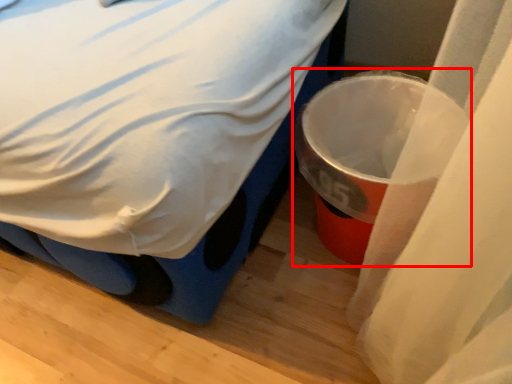
Question: In this image, where is waste container (annotated by the red box) located relative to bed?

Choices:
 (A) left
 (B) right

Answer: (B)